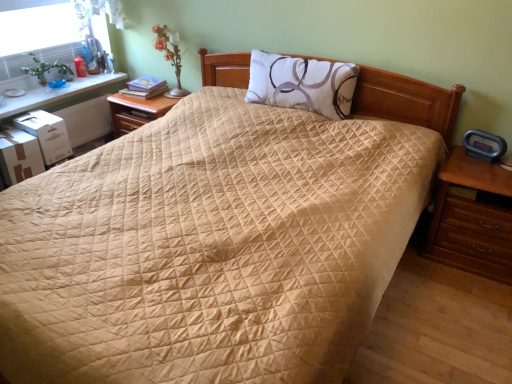
Identify the location of vacant region in front of matte white glass table lamp at upper left. (163, 99).